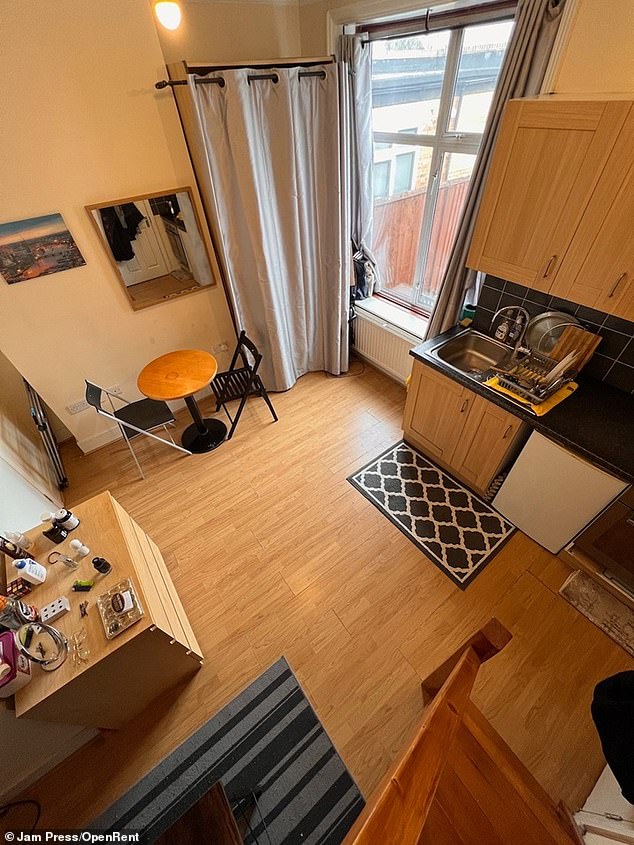
The width and height of the screenshot is (634, 845). In order to click on floor in this screenshot , I will do `click(311, 570)`.